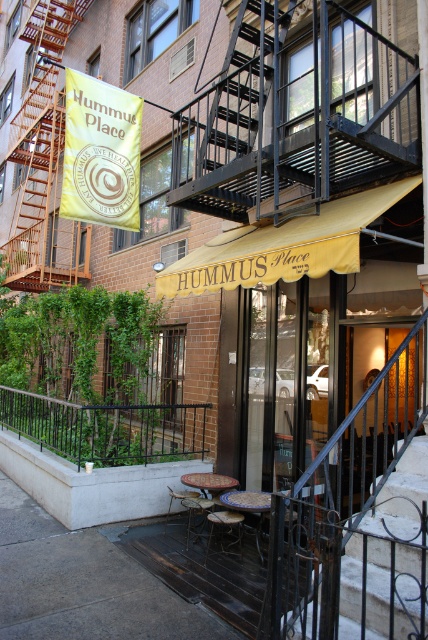
You are a delivery person approaching the entrance of the restaurant and need to place a heavy package on the ground. Which object should you choose between the gray concrete pavement at lower center and the black wrought iron stairs at center to place the package?

The gray concrete pavement at lower center is positioned under the black wrought iron stairs at center, so placing the package on the gray concrete pavement at lower center would be more stable and appropriate since it is the ground level surface.

You are a delivery person with a 4.5 feet wide cart. You need to move from the gray concrete pavement at lower center to the black wrought iron stairs at center. Can your cart fit through the space between them?

The distance between the gray concrete pavement at lower center and the black wrought iron stairs at center is 4.87 feet. Since your cart is 4.5 feet wide, it can fit through the space as it is slightly wider than the cart.